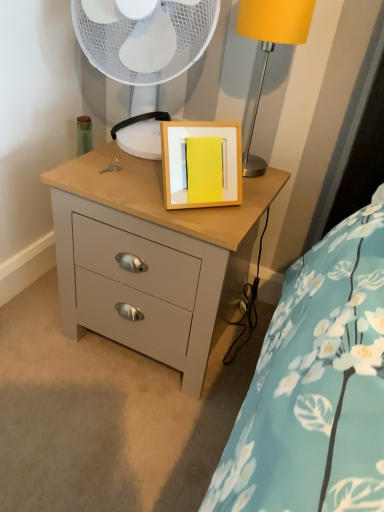
Question: Is matte yellow lampshade at upper right positioned far away from matte gray chest of drawers at center?

Choices:
 (A) no
 (B) yes

Answer: (A)

Question: Could you tell me if matte yellow lampshade at upper right is facing matte gray chest of drawers at center?

Choices:
 (A) yes
 (B) no

Answer: (B)

Question: From the image's perspective, is matte yellow lampshade at upper right located beneath matte gray chest of drawers at center?

Choices:
 (A) yes
 (B) no

Answer: (B)

Question: Is matte yellow lampshade at upper right taller than matte gray chest of drawers at center?

Choices:
 (A) no
 (B) yes

Answer: (A)

Question: Considering the relative positions of matte yellow lampshade at upper right and matte gray chest of drawers at center in the image provided, is matte yellow lampshade at upper right to the left of matte gray chest of drawers at center from the viewer's perspective?

Choices:
 (A) yes
 (B) no

Answer: (B)

Question: Considering the relative sizes of matte yellow lampshade at upper right and matte gray chest of drawers at center in the image provided, is matte yellow lampshade at upper right shorter than matte gray chest of drawers at center?

Choices:
 (A) yes
 (B) no

Answer: (A)

Question: Is white plastic fan at upper center at the right side of matte gray chest of drawers at center?

Choices:
 (A) yes
 (B) no

Answer: (B)

Question: From a real-world perspective, is white plastic fan at upper center under matte gray chest of drawers at center?

Choices:
 (A) yes
 (B) no

Answer: (B)

Question: Can you confirm if white plastic fan at upper center is thinner than matte gray chest of drawers at center?

Choices:
 (A) yes
 (B) no

Answer: (A)

Question: Does white plastic fan at upper center turn towards matte gray chest of drawers at center?

Choices:
 (A) no
 (B) yes

Answer: (A)

Question: Can you confirm if white plastic fan at upper center is smaller than matte gray chest of drawers at center?

Choices:
 (A) no
 (B) yes

Answer: (B)

Question: Is white plastic fan at upper center not near matte gray chest of drawers at center?

Choices:
 (A) no
 (B) yes

Answer: (A)

Question: Considering the relative positions of matte yellow lampshade at upper right and white plastic fan at upper center in the image provided, is matte yellow lampshade at upper right in front of white plastic fan at upper center?

Choices:
 (A) yes
 (B) no

Answer: (A)